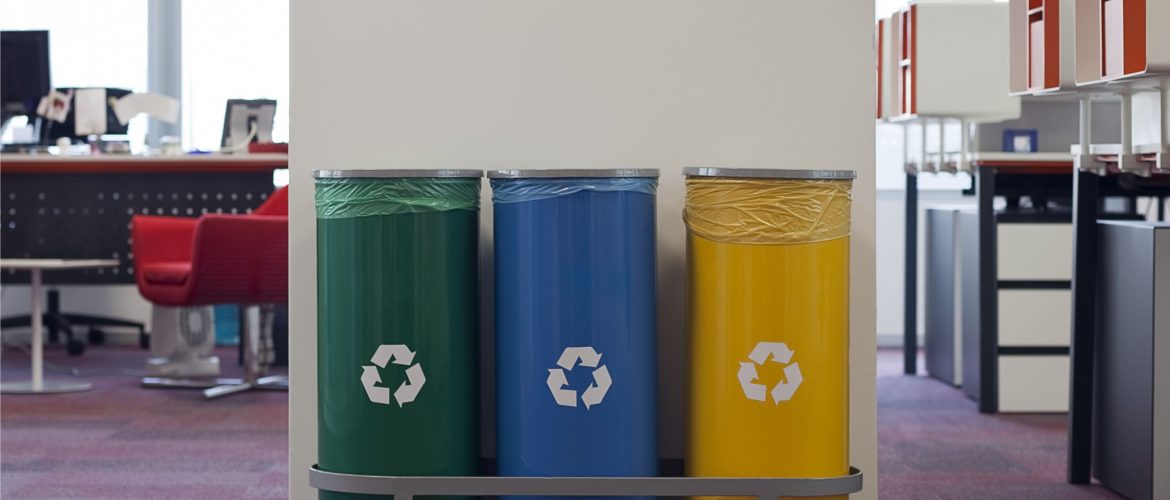
Find the location of a particular element. The height and width of the screenshot is (500, 1170). dark gray cabinet door is located at coordinates (1113, 344).